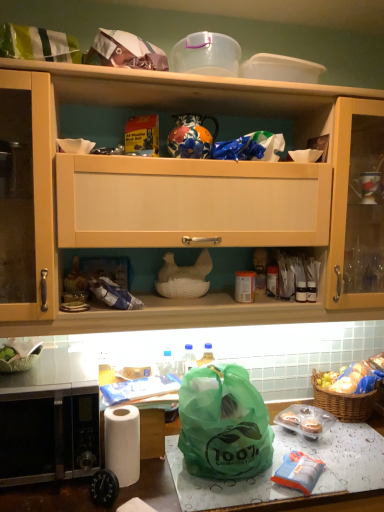
Locate an element on the screen. The height and width of the screenshot is (512, 384). free region on the left part of translucent plastic bag at lower center, positioned as the 3th food in back-to-front order is located at coordinates (245, 488).